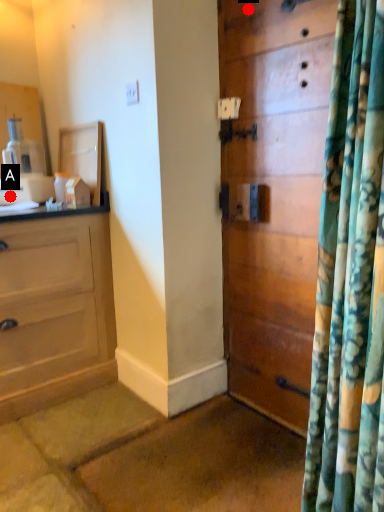
Question: Two points are circled on the image, labeled by A and B beside each circle. Which point appears farthest from the camera in this image?

Choices:
 (A) A is further
 (B) B is further

Answer: (A)